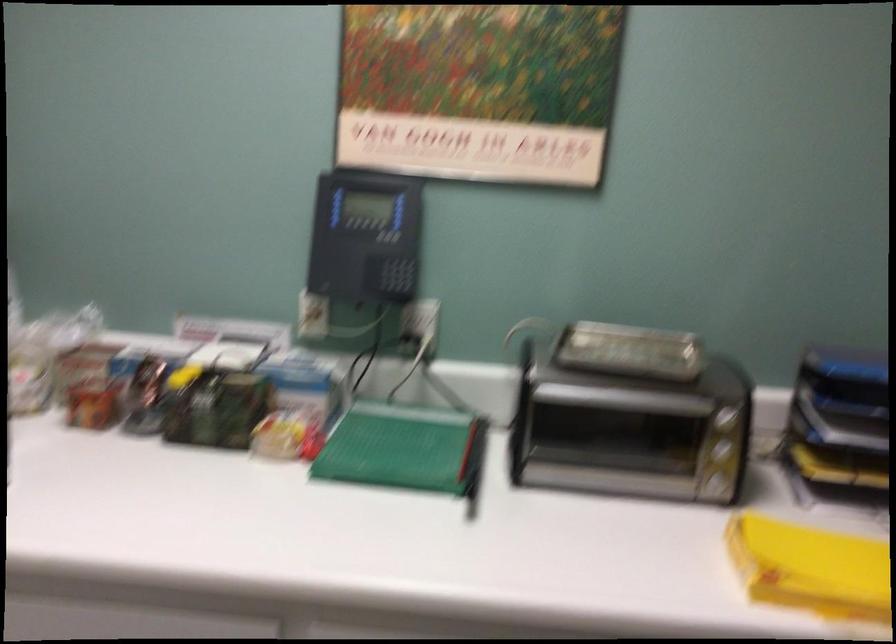
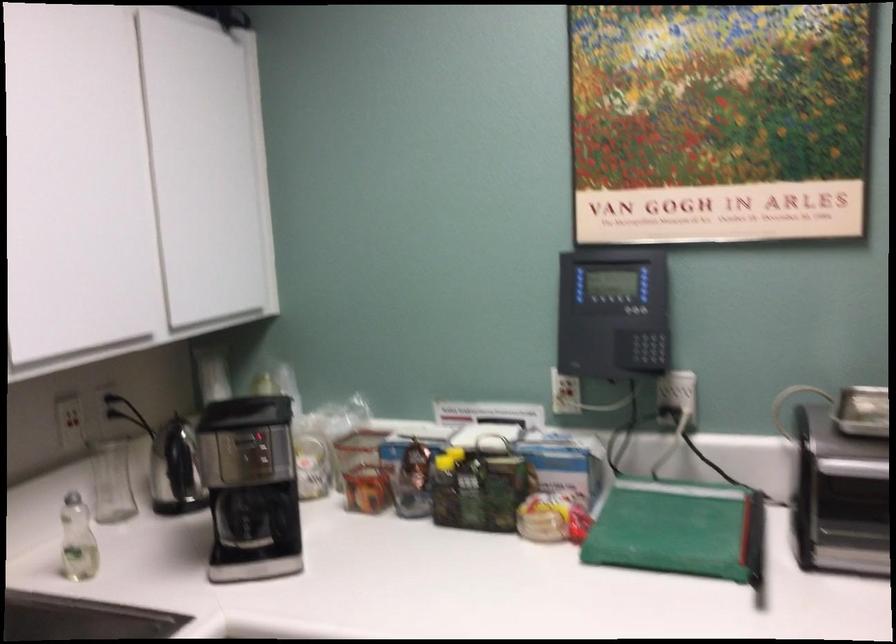
Find the pixel in the second image that matches (181,379) in the first image.

(444, 462)